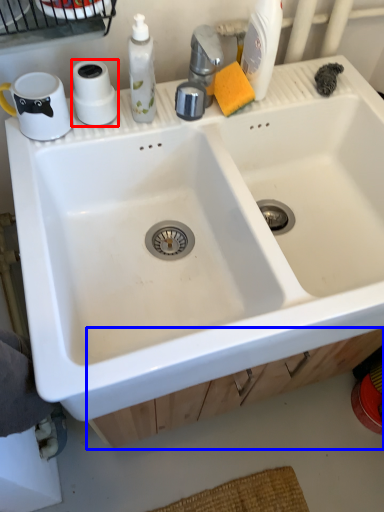
Question: Among these objects, which one is farthest to the camera, toilet paper (highlighted by a red box) or drawer (highlighted by a blue box)?

Choices:
 (A) toilet paper
 (B) drawer

Answer: (B)